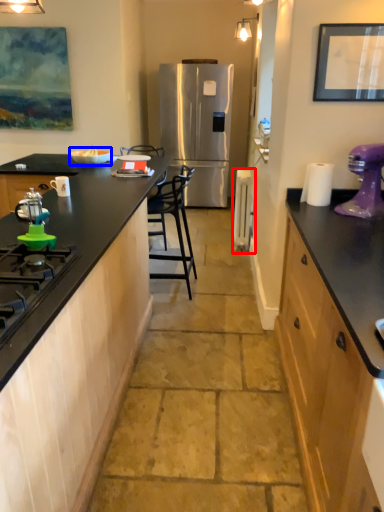
Question: Which object is closer to the camera taking this photo, appliance (highlighted by a red box) or appliance (highlighted by a blue box)?

Choices:
 (A) appliance
 (B) appliance

Answer: (B)